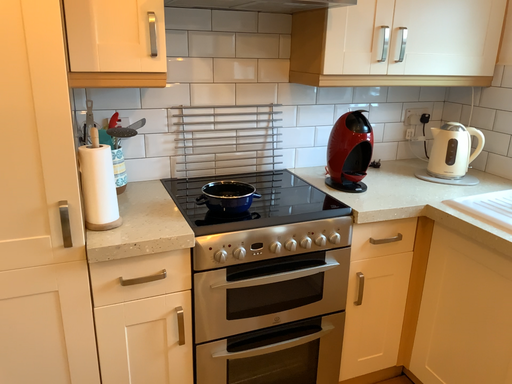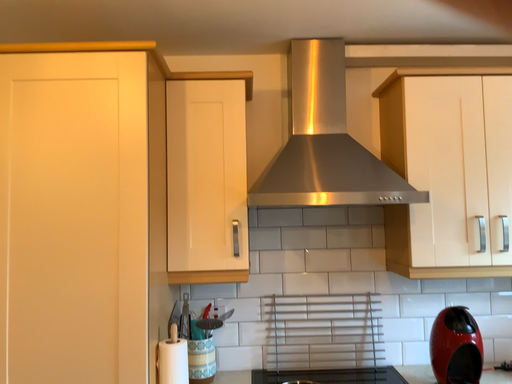
Question: How did the camera likely rotate when shooting the video?

Choices:
 (A) rotated left
 (B) rotated right

Answer: (A)